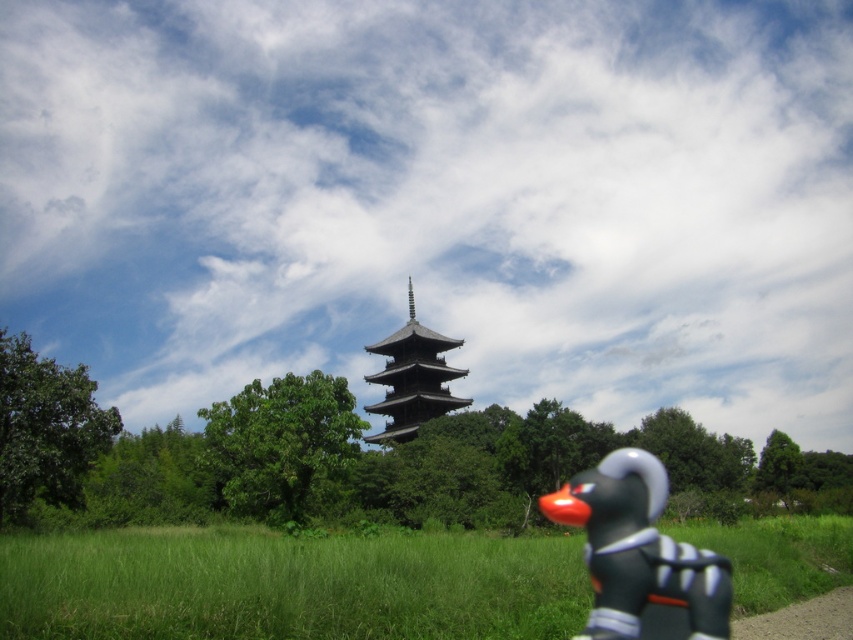
Is green grassy field at lower center positioned in front of matte black figurine at lower right?

No, it is not.

Describe the element at coordinates (289, 584) in the screenshot. I see `green grassy field at lower center` at that location.

Where is `green grassy field at lower center`? Image resolution: width=853 pixels, height=640 pixels. green grassy field at lower center is located at coordinates (289, 584).

Who is taller, matte black figurine at lower right or dark brown wooden tower at center?

dark brown wooden tower at center is taller.

What do you see at coordinates (640, 556) in the screenshot?
I see `matte black figurine at lower right` at bounding box center [640, 556].

I want to click on matte black figurine at lower right, so click(x=640, y=556).

Is the position of green grassy field at lower center more distant than that of dark brown wooden tower at center?

No, green grassy field at lower center is closer to the viewer.

Who is higher up, green grassy field at lower center or dark brown wooden tower at center?

dark brown wooden tower at center

The image size is (853, 640). What are the coordinates of `green grassy field at lower center` in the screenshot? It's located at (289, 584).

Identify the location of green grassy field at lower center. This screenshot has height=640, width=853. (289, 584).